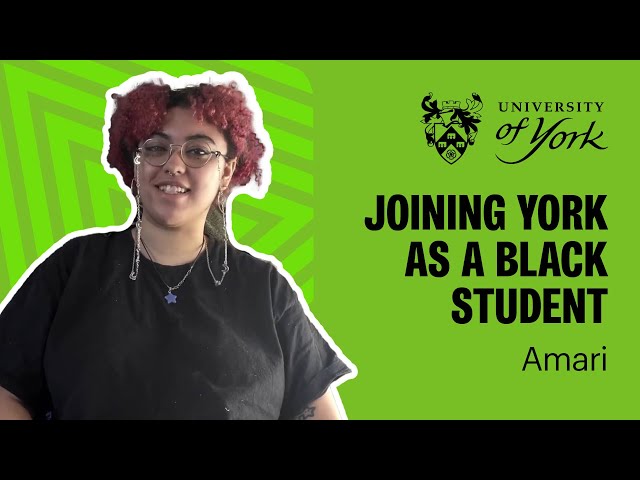
Identify the location of glasses holders. (136, 271).